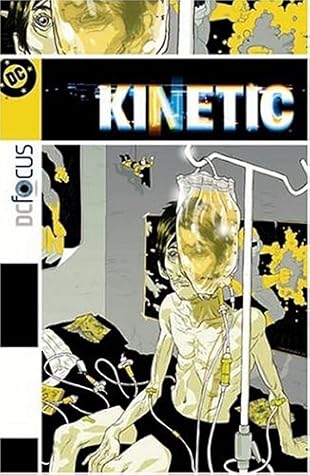
The image size is (310, 475). Find the location of `figurine of superhero`. figurine of superhero is located at coordinates pyautogui.click(x=138, y=168).